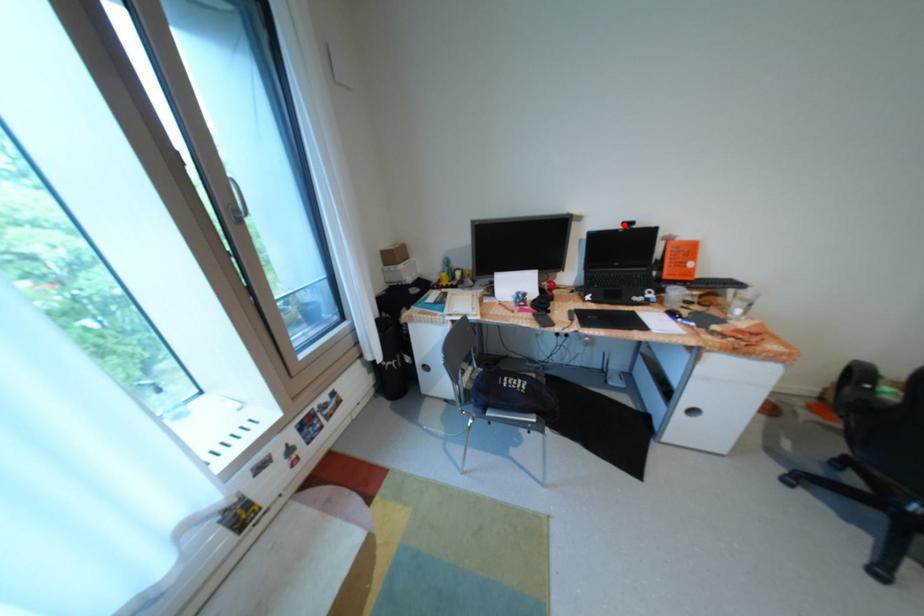
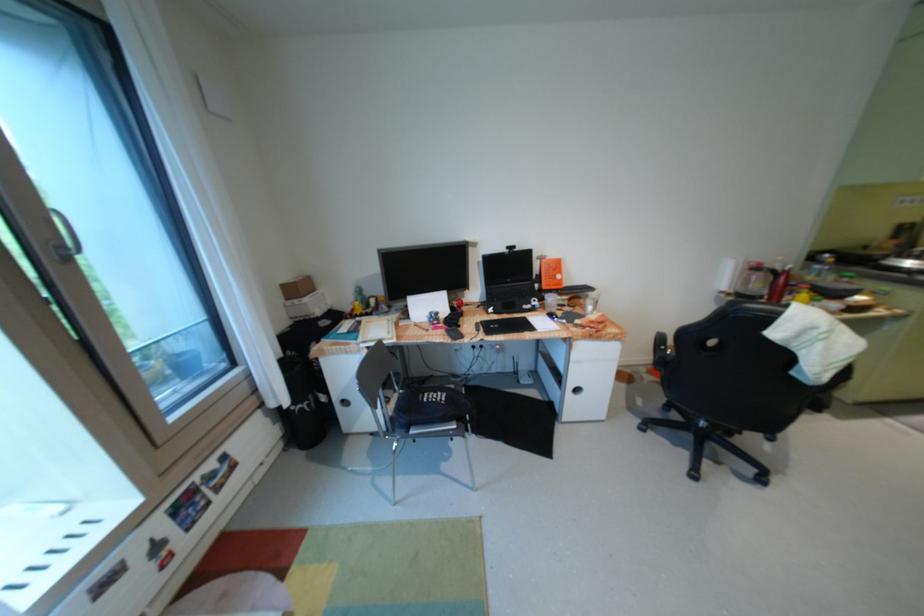
Question: I am providing you with two images of the same scene from different viewpoints. A red point is marked on the first image. Can you still see the location of the red point in image 2?

Choices:
 (A) Yes
 (B) No

Answer: (A)